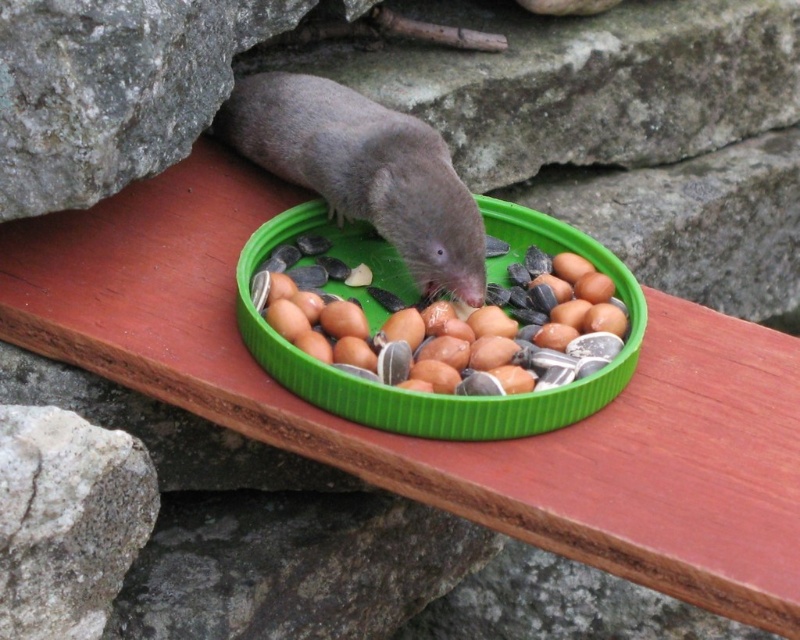
You are standing at the edge of the wooden platform where the animal is. You want to place a treat exactly at point (356, 272). If your hand can reach up to 1.5 meters, will you be able to reach that point?

The distance between point (356, 272) and the viewer is 1.79 meters, which is beyond the 1.5 meter reach of your hand. Therefore, you cannot reach that point.